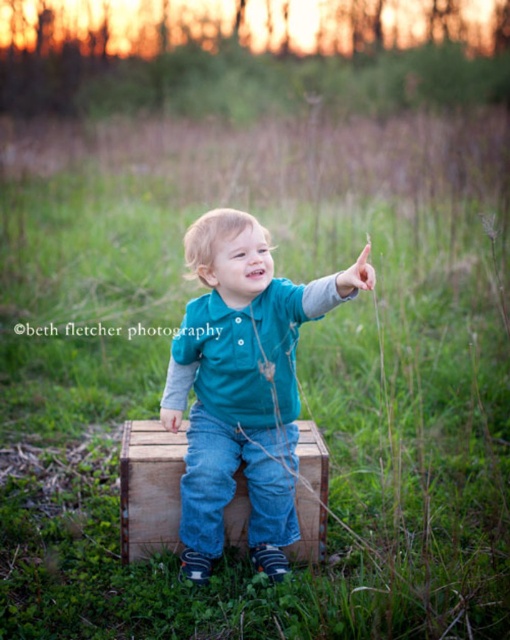
Looking at this image, you are a photographer trying to capture the child in the scene. The teal fabric shirt at center and wooden crate at center are both in the frame. Which object takes up more space in the photo?

The teal fabric shirt at center is bigger than the wooden crate at center, so it takes up more space in the photo.

You are a photographer trying to capture the perfect shot of the child in the scene. You need to ensure that the distance between the teal fabric shirt at center and the wooden crate at center is exactly 12 inches. Based on the current setup, do you need to adjust the position of the child or the crate to achieve this?

The teal fabric shirt at center is currently 10.92 inches from the wooden crate at center. To reach the desired 12 inches, you need to move either the child or the crate approximately 1.08 inches further apart.